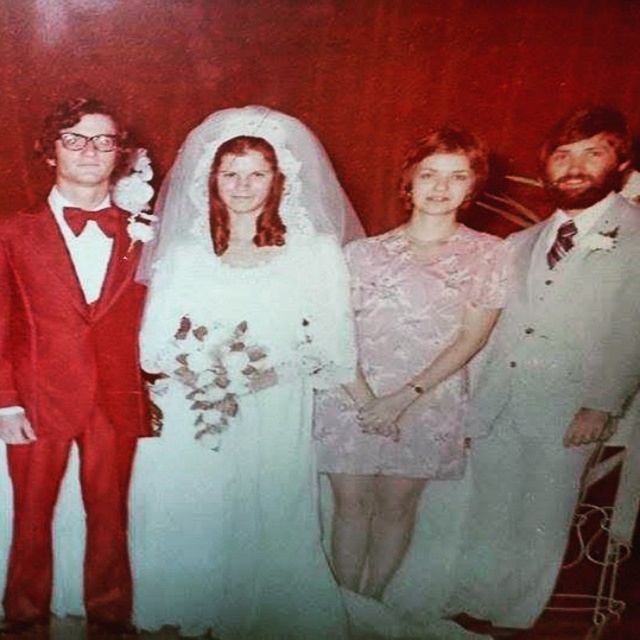
Question: Which of the following is the farthest from the observer?

Choices:
 (A) (435, 200)
 (B) (65, 304)
 (C) (604, 200)

Answer: (A)

Question: Does white satin dress at center have a lesser width compared to pink lace dress at center?

Choices:
 (A) yes
 (B) no

Answer: (B)

Question: Which object is the closest to the pink lace dress at center?

Choices:
 (A) white satin dress at center
 (B) light blue satin suit at right

Answer: (B)

Question: Is white satin dress at center below pink lace dress at center?

Choices:
 (A) no
 (B) yes

Answer: (B)

Question: Which object appears farthest from the camera in this image?

Choices:
 (A) light blue satin suit at right
 (B) shiny red suit at left

Answer: (A)

Question: Does light blue satin suit at right come behind pink lace dress at center?

Choices:
 (A) no
 (B) yes

Answer: (A)